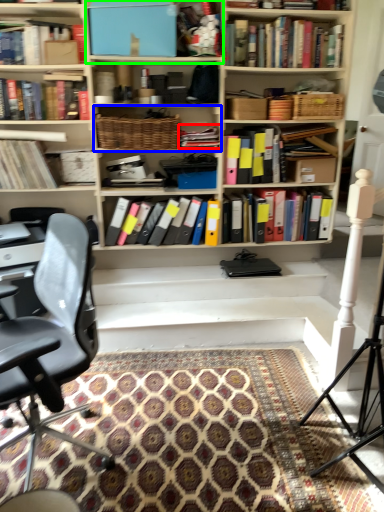
Question: Which object is positioned closest to book (highlighted by a red box)? Select from cabinet (highlighted by a blue box) and cabinet (highlighted by a green box).

Choices:
 (A) cabinet
 (B) cabinet

Answer: (A)